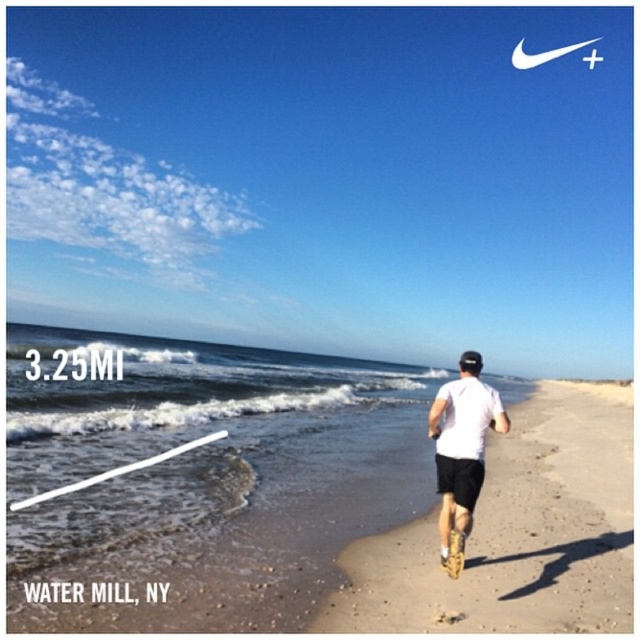
Can you confirm if sandy beach at center is thinner than white matte shirt at center?

In fact, sandy beach at center might be wider than white matte shirt at center.

Consider the image. Measure the distance between sandy beach at center and camera.

sandy beach at center and camera are 5.65 meters apart from each other.

Locate an element on the screen. sandy beach at center is located at coordinates (516, 532).